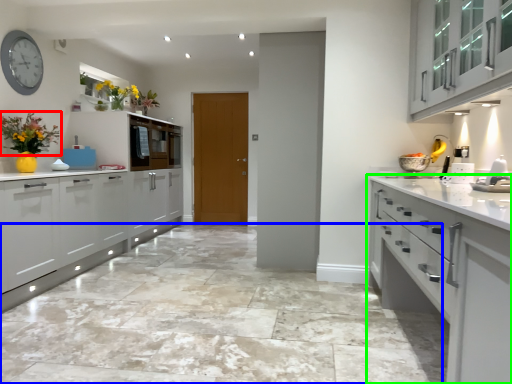
Question: Considering the real-world distances, which object is farthest from floral arrangement (highlighted by a red box)? granite (highlighted by a blue box) or cabinetry (highlighted by a green box)?

Choices:
 (A) granite
 (B) cabinetry

Answer: (B)